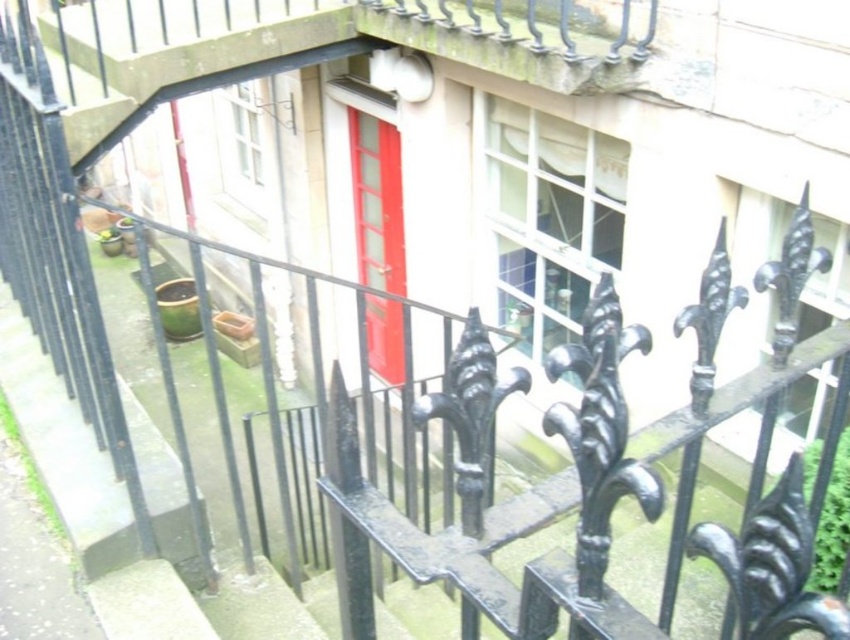
Question: Which of the following is the closest to the observer?

Choices:
 (A) (514, 61)
 (B) (367, 138)

Answer: (A)

Question: Does smooth concrete balcony at upper center come in front of matte red door at center?

Choices:
 (A) no
 (B) yes

Answer: (B)

Question: Is smooth concrete balcony at upper center positioned at the back of matte red door at center?

Choices:
 (A) yes
 (B) no

Answer: (B)

Question: Which of the following is the farthest from the observer?

Choices:
 (A) (360, 32)
 (B) (378, 320)

Answer: (B)

Question: Among these points, which one is farthest from the camera?

Choices:
 (A) (392, 200)
 (B) (422, 12)

Answer: (A)

Question: Is smooth concrete balcony at upper center thinner than matte red door at center?

Choices:
 (A) no
 (B) yes

Answer: (A)